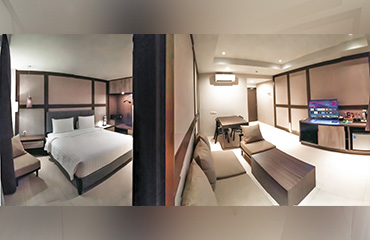
The image size is (370, 240). In order to click on bedside tables in this screenshot , I will do `click(32, 140)`, `click(109, 126)`.